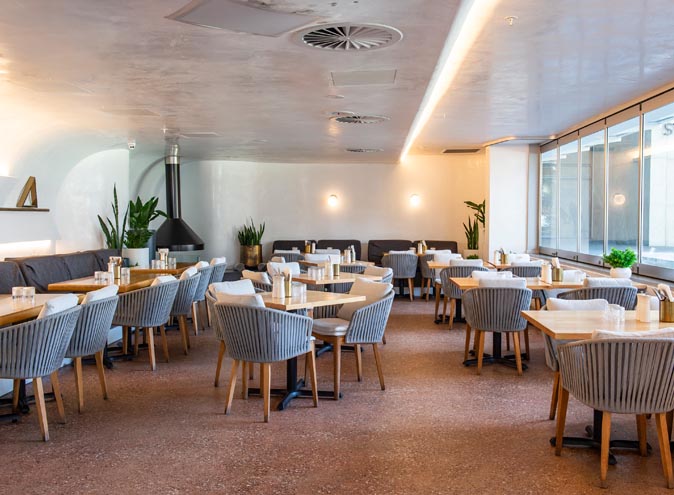
The height and width of the screenshot is (495, 674). I want to click on window, so click(96, 425), click(543, 200), click(567, 205), click(590, 201), click(621, 199), click(654, 197).